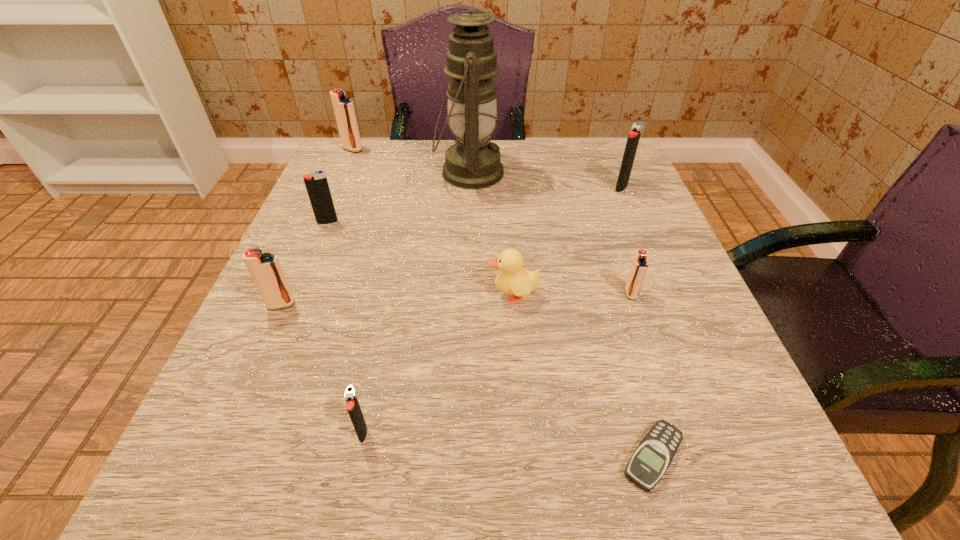
You are a GUI agent. You are given a task and a screenshot of the screen. Output one action in this format:
    pyautogui.click(x=<x>, y=<y>)
    Task: Click on the vacant area between the second smallest red igniter and the farthest igniter
    
    Given the screenshot: What is the action you would take?
    pyautogui.click(x=317, y=227)

I want to click on vacant space that's between the gray beeper and the second farthest black igniter, so click(491, 340).

The image size is (960, 540). Identify the location of blank region between the tallest object and the shortest object. (561, 315).

The image size is (960, 540). I want to click on free area in between the leftmost black igniter and the yellow duckling, so click(x=420, y=259).

At what (x,y) coordinates should I click in order to perform the action: click on empty space between the fourth object from left to right and the gray beeper. Please return your answer as a coordinate pair (x, y). This screenshot has width=960, height=540. Looking at the image, I should click on (508, 444).

Identify the location of unoccupied area between the biggest black igniter and the smallest red igniter. Image resolution: width=960 pixels, height=540 pixels. (626, 241).

Find the location of a particular element. Image resolution: width=960 pixels, height=540 pixels. free space that is in between the rightmost object and the second smallest red igniter is located at coordinates (451, 246).

You are a GUI agent. You are given a task and a screenshot of the screen. Output one action in this format:
    pyautogui.click(x=<x>, y=<y>)
    Task: Click on the vacant area that lies between the biggest red igniter and the second biggest red igniter
    This screenshot has height=540, width=960.
    Given the screenshot: What is the action you would take?
    pyautogui.click(x=317, y=227)

Locate which object is the closest to the duckling. Please provide its 2D coordinates. Your answer should be formatted as a tuple, i.e. [(x, y)], where the tuple contains the x and y coordinates of a point satisfying the conditions above.

[(639, 266)]

Where is `object that ranks as the sixth closest to the smallest red igniter`? The image size is (960, 540). object that ranks as the sixth closest to the smallest red igniter is located at coordinates (265, 269).